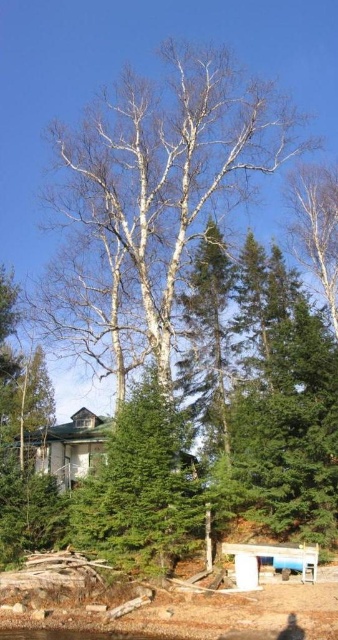
You are planning to take a photo of the white smooth birch tree at center and the wooden park bench at lower center. Which object should you focus on first if you want to include both in your frame without moving the camera?

The white smooth birch tree at center is larger in size than the wooden park bench at lower center, so you should focus on the white smooth birch tree at center first to ensure it fits properly in the frame before adjusting for the smaller bench.

You are standing at the origin point of the coordinate system in this scene. You want to walk towards the green matte evergreen tree at center. Which direction should you move in to reach it?

Since the green matte evergreen tree at center is located at point 0.764 on the x axis and 0.420 on the y axis, you should move towards the right and slightly forward to reach it.